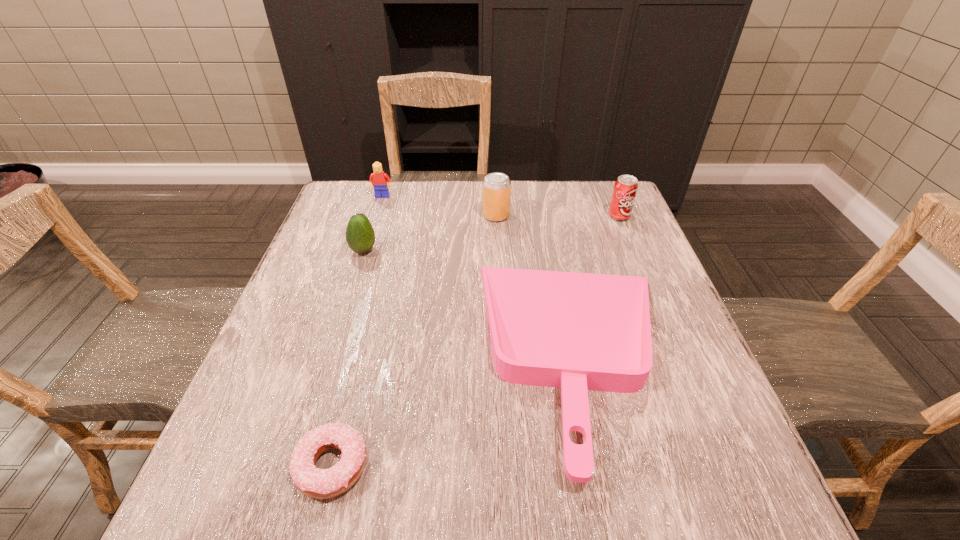
Identify the location of soda that is at the right edge. The image size is (960, 540). (625, 188).

Identify the location of dustpan situated at the right edge. This screenshot has width=960, height=540. (576, 331).

Identify the location of object at the far left corner. (378, 179).

Locate an element on the screen. This screenshot has width=960, height=540. object positioned at the near left corner is located at coordinates (316, 483).

I want to click on object that is at the far right corner, so click(625, 188).

The width and height of the screenshot is (960, 540). I want to click on object that is at the near right corner, so click(576, 331).

The width and height of the screenshot is (960, 540). In order to click on free space at the far edge of the desktop in this screenshot , I will do `click(444, 201)`.

Locate an element on the screen. This screenshot has height=540, width=960. free space at the near edge of the desktop is located at coordinates (328, 502).

Locate an element on the screen. This screenshot has width=960, height=540. vacant space at the left edge is located at coordinates (230, 414).

At what (x,y) coordinates should I click in order to perform the action: click on free space at the right edge of the desktop. Please return your answer as a coordinate pair (x, y). This screenshot has width=960, height=540. Looking at the image, I should click on (683, 330).